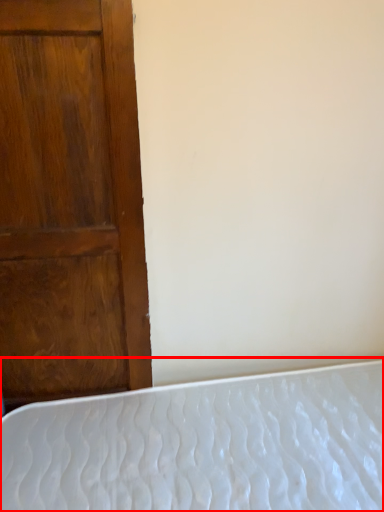
Question: Considering the relative positions of bed (annotated by the red box) and door in the image provided, where is bed (annotated by the red box) located with respect to the staircase?

Choices:
 (A) left
 (B) right

Answer: (B)